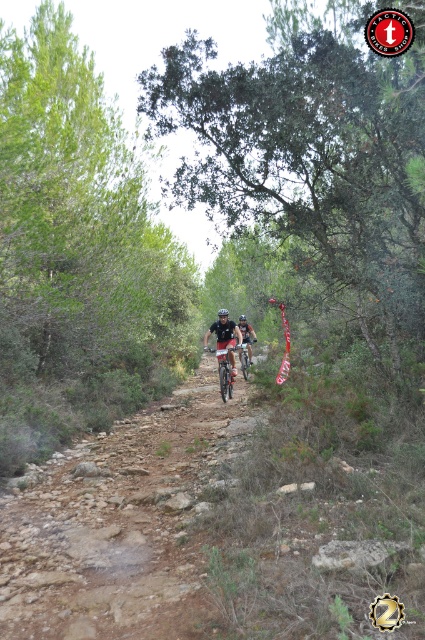
Is dirt/rocky terrain at center below matte black helmet at center?

Indeed, dirt/rocky terrain at center is positioned under matte black helmet at center.

Can you confirm if dirt/rocky terrain at center is smaller than matte black helmet at center?

No, dirt/rocky terrain at center is not smaller than matte black helmet at center.

At what (x,y) coordinates should I click in order to perform the action: click on dirt/rocky terrain at center. Please return your answer as a coordinate pair (x, y). This screenshot has height=640, width=425. Looking at the image, I should click on (121, 522).

Does dirt/rocky terrain at center have a smaller size compared to metallic silver bicycle at center?

Actually, dirt/rocky terrain at center might be larger than metallic silver bicycle at center.

Which is in front, point (39, 531) or point (249, 360)?

Point (39, 531) is in front.

Where is `dirt/rocky terrain at center`? The image size is (425, 640). dirt/rocky terrain at center is located at coordinates (121, 522).

Who is more distant from viewer, (220, 488) or (218, 356)?

Positioned behind is point (218, 356).

Does point (93, 552) come closer to viewer compared to point (226, 380)?

Yes.

Which is in front, point (68, 488) or point (221, 387)?

Positioned in front is point (68, 488).

Image resolution: width=425 pixels, height=640 pixels. In order to click on dirt/rocky terrain at center in this screenshot , I will do `click(121, 522)`.